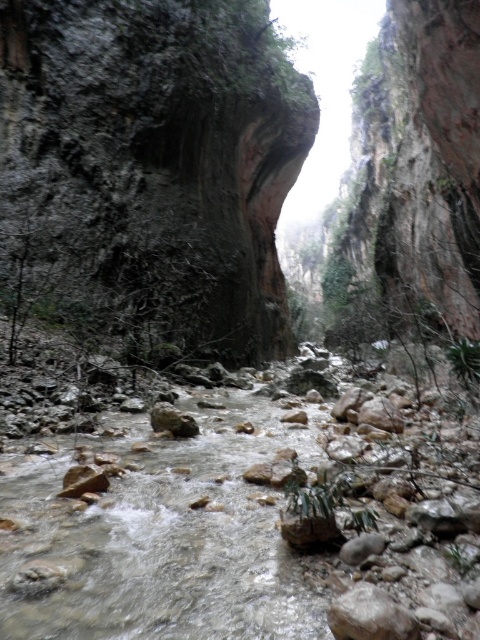
Between dark gray rock face at upper center and smooth gray rock at center, which one is positioned lower?

Positioned lower is smooth gray rock at center.

Can you confirm if dark gray rock face at upper center is smaller than smooth gray rock at center?

Incorrect, dark gray rock face at upper center is not smaller in size than smooth gray rock at center.

Is point (267, 323) positioned behind point (169, 412)?

Yes, point (267, 323) is farther from viewer.

Where is `dark gray rock face at upper center`? The height and width of the screenshot is (640, 480). dark gray rock face at upper center is located at coordinates (149, 172).

Who is lower down, white rocky stream at center or smooth gray rock at center?

white rocky stream at center

Where is `white rocky stream at center`? This screenshot has width=480, height=640. white rocky stream at center is located at coordinates tap(160, 536).

How far apart are dark gray rock face at upper center and white rocky stream at center?

A distance of 48.16 feet exists between dark gray rock face at upper center and white rocky stream at center.

Is point (309, 106) positioned behind point (51, 621)?

That is True.

Does point (135, 189) come behind point (78, 552)?

That is True.

At what (x,y) coordinates should I click in order to perform the action: click on dark gray rock face at upper center. Please return your answer as a coordinate pair (x, y). Looking at the image, I should click on (149, 172).